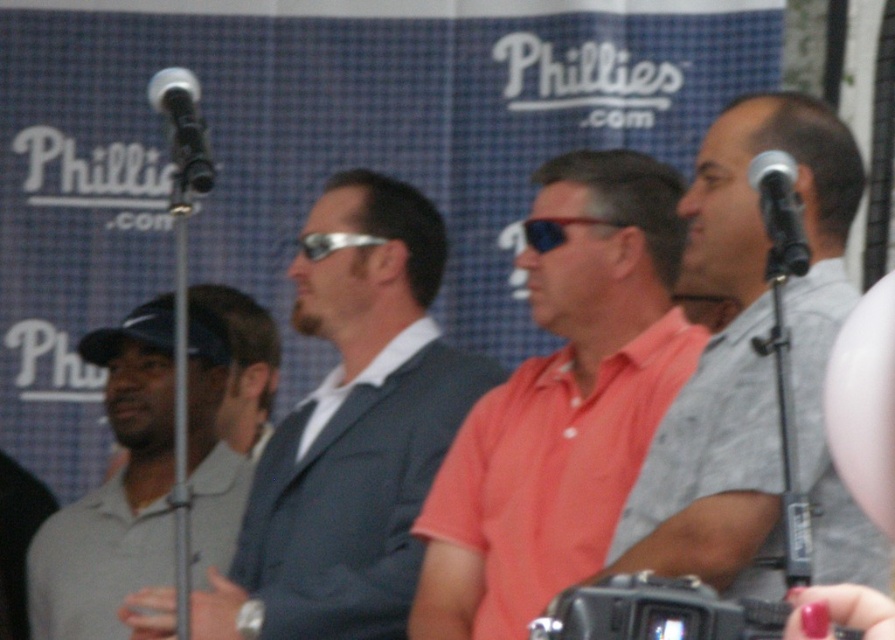
You are a photographer at the Phillies.com event. You need to ensure that the matte gray suit at center and sunglasses at center are visible in your photo. Given their sizes, which object will appear wider in the frame?

The matte gray suit at center will appear wider in the frame because its width surpasses that of the sunglasses at center.

What is the exact position of the silver metallic microphone at upper right in the image?

The silver metallic microphone at upper right is located at point [780,214].

You are standing in front of the Phillies.com backdrop and see two points marked in the image. Which point is closer to you, point (x=512, y=378) or point (x=186, y=179)?

Point (x=512, y=378) is closer to you than point (x=186, y=179) because it is further to the viewer.